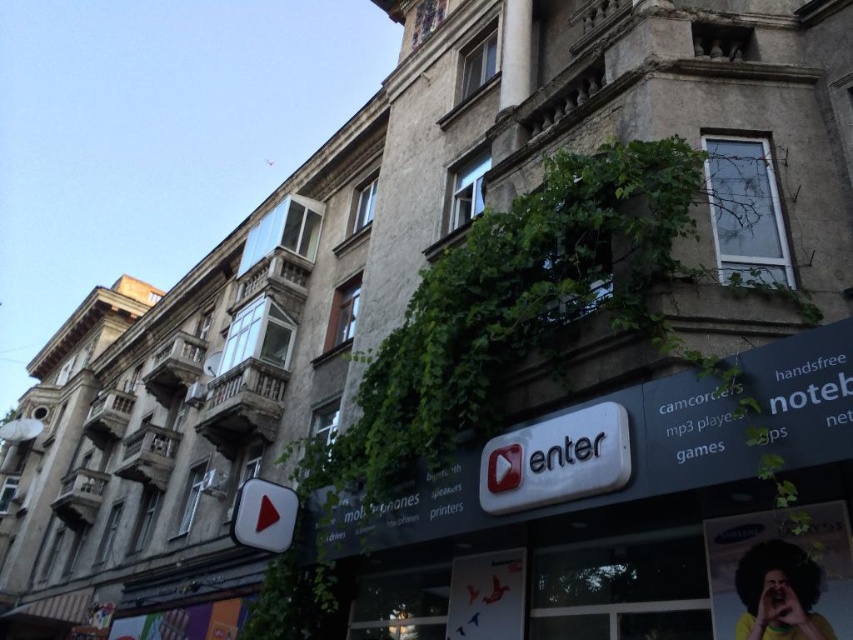
You are standing in front of the building and want to locate the entrance. You see the white plastic sign at center and the shiny red play button at lower left. Which object is closer to you?

The white plastic sign at center is closer to the viewer than the shiny red play button at lower left.

Consider the image. You are standing in front of the building and see the white plastic sign at center and the shiny red play button at lower left. Which object is located to the right of the other?

The white plastic sign at center is positioned on the right side of shiny red play button at lower left.